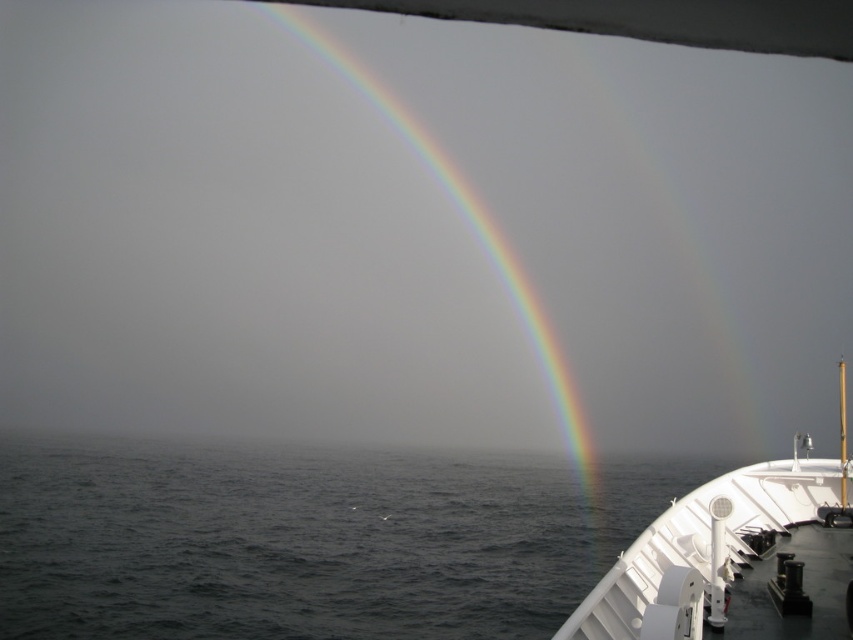
You are standing on the ship deck and looking at the dark blue water at lower left and the rainbow at upper center. Which object appears larger in the scene?

The rainbow at upper center appears larger than the dark blue water at lower left.

You are standing on the ship deck and looking towards the rainbow. Which of the two points, point (502,528) or point (767,616), is closer to you?

Point (767,616) is closer to you because it is in front of point (502,528).